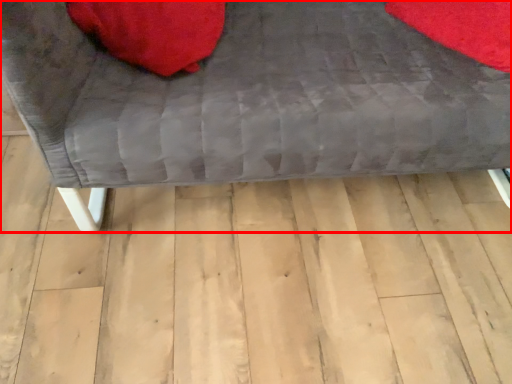
Question: Where is furniture (annotated by the red box) located in relation to bean bag chair in the image?

Choices:
 (A) right
 (B) left

Answer: (A)